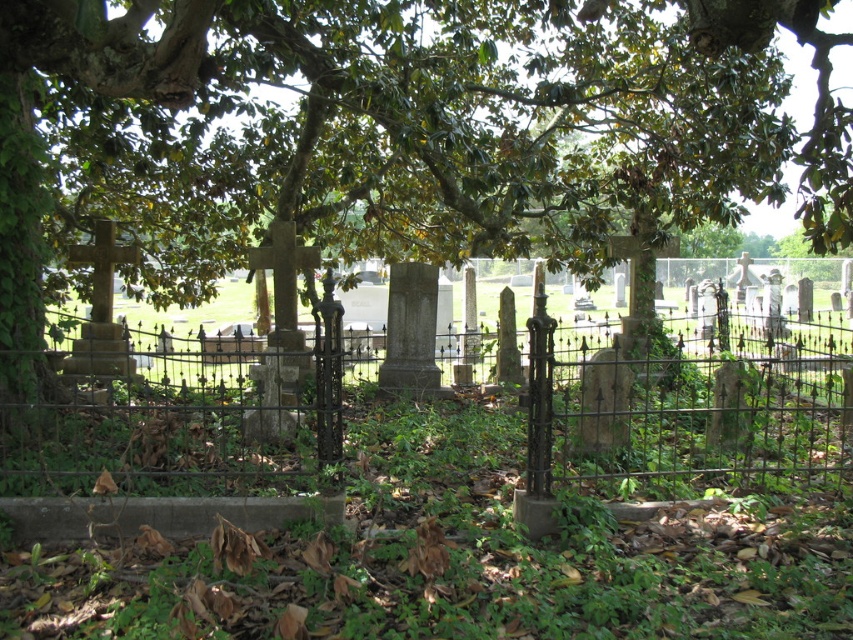
Can you confirm if green leafy tree at center is positioned below rusty iron fence at center?

Actually, green leafy tree at center is above rusty iron fence at center.

Does point (451, 193) lie behind point (631, 419)?

Yes, point (451, 193) is behind point (631, 419).

This screenshot has width=853, height=640. Find the location of `green leafy tree at center`. green leafy tree at center is located at coordinates (393, 131).